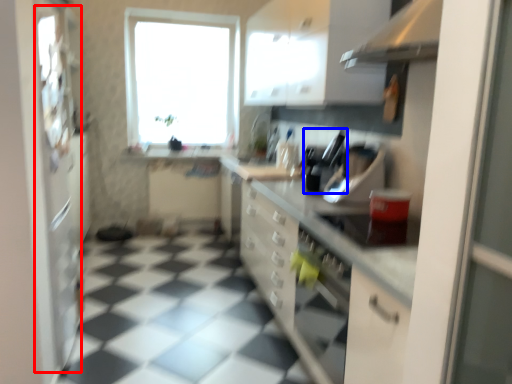
Question: Which point is closer to the camera, screen door (highlighted by a red box) or appliance (highlighted by a blue box)?

Choices:
 (A) screen door
 (B) appliance

Answer: (A)